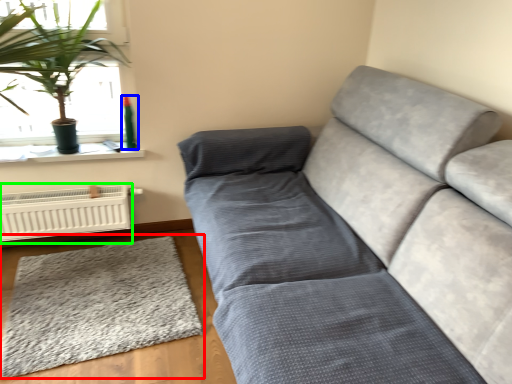
Question: Considering the real-world distances, which object is farthest from mat (highlighted by a red box)? teal (highlighted by a blue box) or heater (highlighted by a green box)?

Choices:
 (A) teal
 (B) heater

Answer: (A)